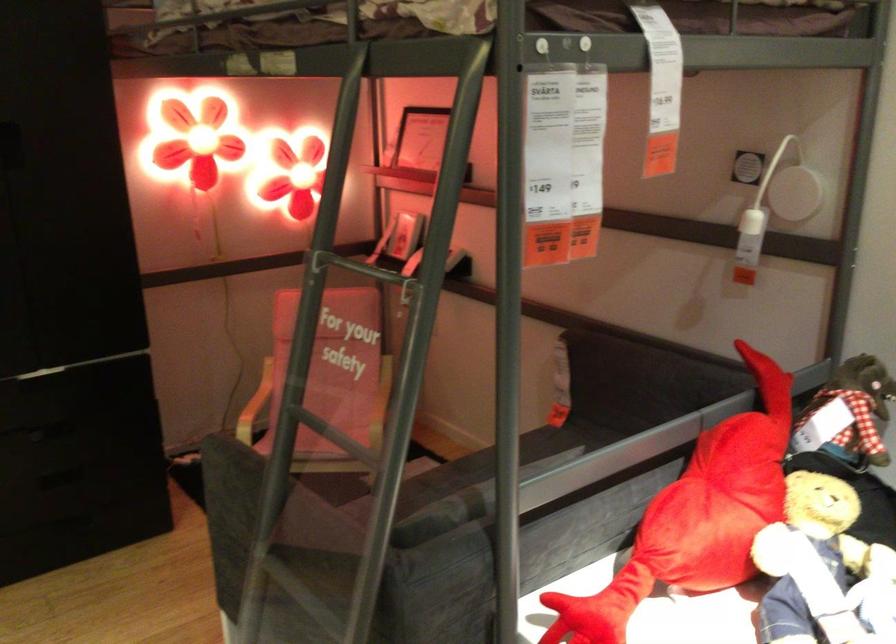
Locate an element on the screen. The image size is (896, 644). dark sofa sitting surface is located at coordinates (567, 437).